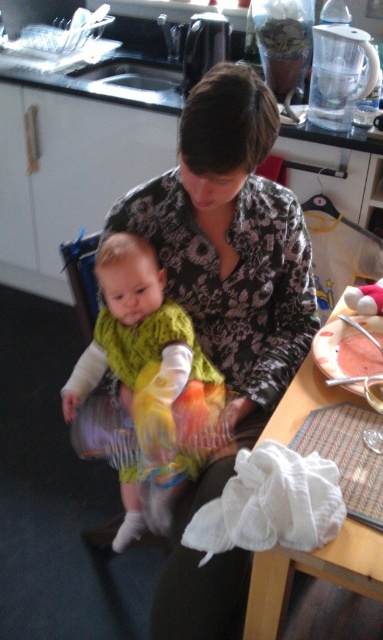
Based on the photo, does black floral shirt at center appear on the right side of pink matte cake at right?

Incorrect, black floral shirt at center is not on the right side of pink matte cake at right.

Who is shorter, black floral shirt at center or pink matte cake at right?

Standing shorter between the two is pink matte cake at right.

Does point (235, 301) come farther from viewer compared to point (343, 374)?

Yes, point (235, 301) is behind point (343, 374).

Where is `black floral shirt at center`? The height and width of the screenshot is (640, 383). black floral shirt at center is located at coordinates (232, 243).

Is point (271, 278) behind point (188, 384)?

Yes, point (271, 278) is farther from viewer.

What do you see at coordinates (232, 243) in the screenshot? I see `black floral shirt at center` at bounding box center [232, 243].

Does point (160, 205) lie in front of point (130, 476)?

Yes, it is.

Identify the location of black floral shirt at center. (232, 243).

Is point (183, 435) behind point (342, 572)?

Yes, point (183, 435) is behind point (342, 572).

Between point (168, 406) and point (379, 577), which one is positioned in front?

Point (379, 577) is in front.

Image resolution: width=383 pixels, height=640 pixels. In order to click on multicolored fabric dress at center in this screenshot , I will do `click(148, 381)`.